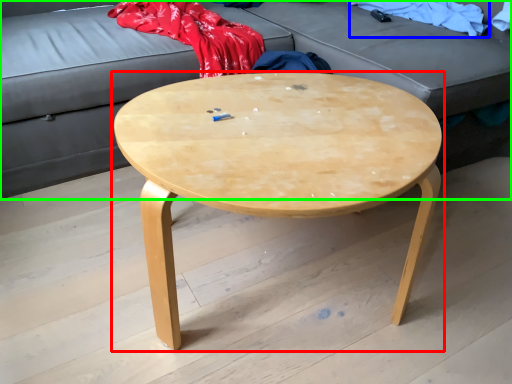
Question: Estimate the real-world distances between objects in this image. Which object is closer to coffee table (highlighted by a red box), clothing (highlighted by a blue box) or studio couch (highlighted by a green box)?

Choices:
 (A) clothing
 (B) studio couch

Answer: (B)